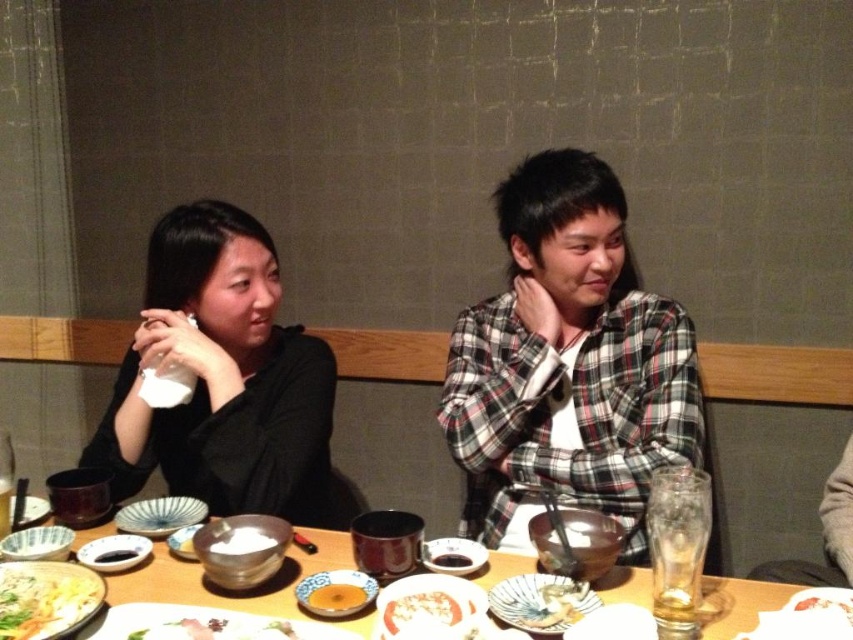
From the picture: Between matte white plate at center and translucent glass at table center, which one has less height?

matte white plate at center is shorter.

Does matte white plate at center have a lesser width compared to translucent glass at table center?

No.

Where is `matte white plate at center`? matte white plate at center is located at coordinates (428, 604).

Does point (158, 508) come in front of point (109, 548)?

No, it is behind (109, 548).

Does porcelain plate at center appear over matte black plate at center?

Indeed, porcelain plate at center is positioned over matte black plate at center.

Image resolution: width=853 pixels, height=640 pixels. I want to click on porcelain plate at center, so (160, 515).

Find the location of a particular element. porcelain plate at center is located at coordinates (160, 515).

Does point (160, 560) come in front of point (126, 557)?

No, it is behind (126, 557).

This screenshot has width=853, height=640. Describe the element at coordinates (227, 592) in the screenshot. I see `wooden table at center` at that location.

Does point (643, 595) lie in front of point (113, 561)?

Yes, point (643, 595) is closer to viewer.

I want to click on wooden table at center, so (227, 592).